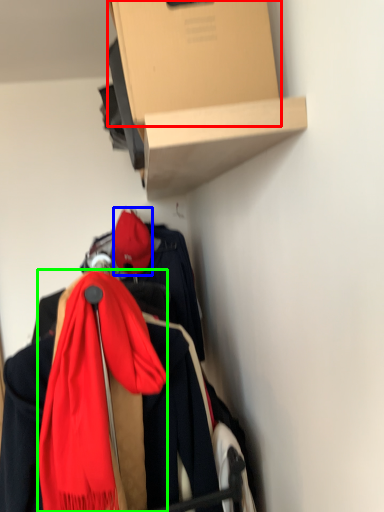
Question: Considering the real-world distances, which object is farthest from cardboard box (highlighted by a red box)? hat (highlighted by a blue box) or scarf (highlighted by a green box)?

Choices:
 (A) hat
 (B) scarf

Answer: (A)